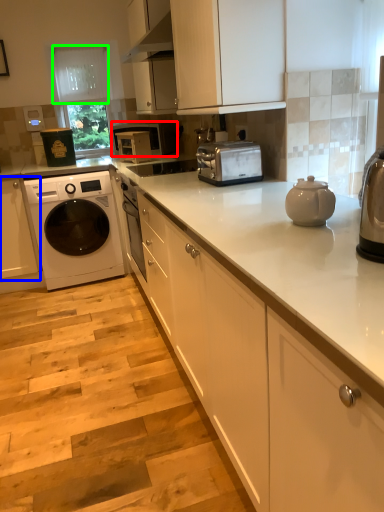
Question: Which object is the closest to the microwave oven (highlighted by a red box)? Choose among these: cabinetry (highlighted by a blue box) or glass door (highlighted by a green box).

Choices:
 (A) cabinetry
 (B) glass door

Answer: (B)